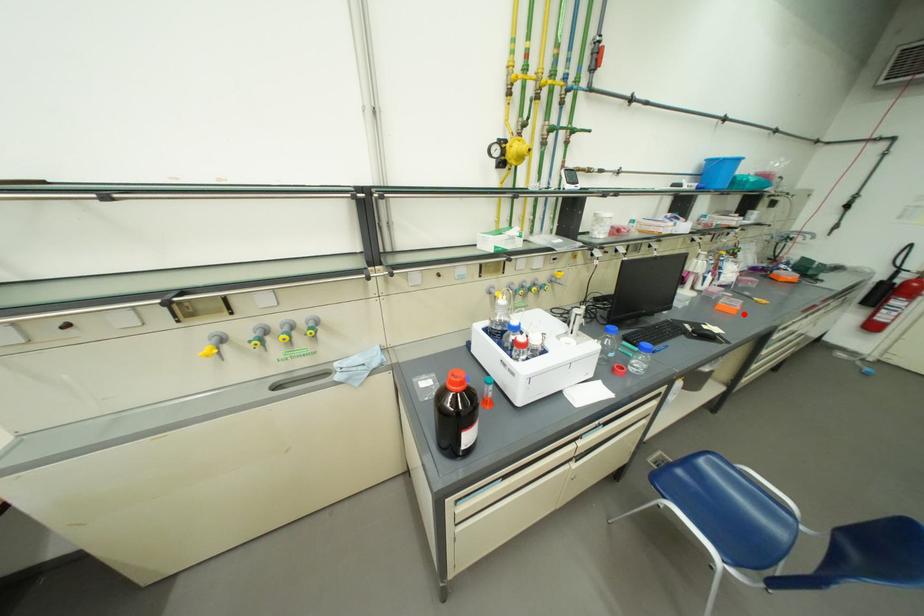
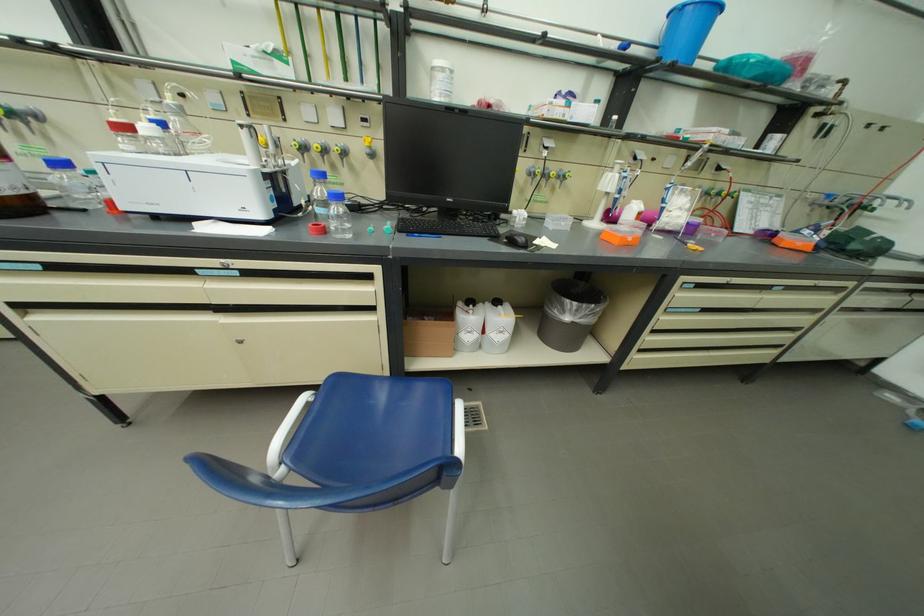
Where in the second image is the point corresponding to the highlighted location from the first image?

(626, 244)